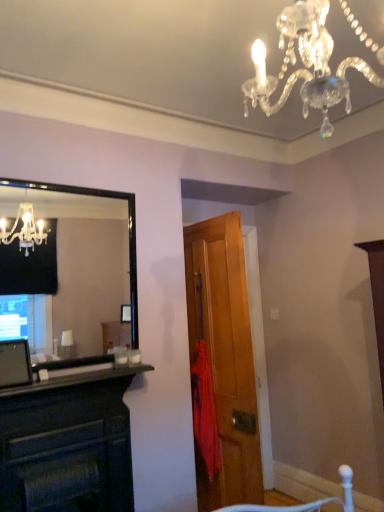
Question: Considering the relative sizes of wooden door at center and black matte fireplace at lower left in the image provided, is wooden door at center bigger than black matte fireplace at lower left?

Choices:
 (A) yes
 (B) no

Answer: (A)

Question: From the image's perspective, is wooden door at center on top of black matte fireplace at lower left?

Choices:
 (A) no
 (B) yes

Answer: (A)

Question: Is black matte fireplace at lower left completely or partially inside wooden door at center?

Choices:
 (A) no
 (B) yes

Answer: (A)

Question: Is wooden door at center further to the viewer compared to black matte fireplace at lower left?

Choices:
 (A) no
 (B) yes

Answer: (B)

Question: Is wooden door at center in front of black matte fireplace at lower left?

Choices:
 (A) yes
 (B) no

Answer: (B)

Question: Would you say black matte fireplace at lower left is to the left or to the right of red fabric umbrella at center in the picture?

Choices:
 (A) right
 (B) left

Answer: (B)

Question: From the image's perspective, relative to red fabric umbrella at center, is black matte fireplace at lower left above or below?

Choices:
 (A) above
 (B) below

Answer: (A)

Question: Is black matte fireplace at lower left situated inside red fabric umbrella at center or outside?

Choices:
 (A) outside
 (B) inside

Answer: (A)

Question: Is black matte fireplace at lower left wider or thinner than red fabric umbrella at center?

Choices:
 (A) wide
 (B) thin

Answer: (A)

Question: Relative to wooden door at center, is red fabric umbrella at center in front or behind?

Choices:
 (A) behind
 (B) front

Answer: (A)

Question: From the image's perspective, is red fabric umbrella at center located above or below wooden door at center?

Choices:
 (A) above
 (B) below

Answer: (B)

Question: Visually, is red fabric umbrella at center positioned to the left or to the right of wooden door at center?

Choices:
 (A) left
 (B) right

Answer: (A)

Question: Does point pyautogui.click(x=198, y=423) appear closer or farther from the camera than point pyautogui.click(x=254, y=416)?

Choices:
 (A) closer
 (B) farther

Answer: (A)

Question: From their relative heights in the image, would you say black glass mirror at left is taller or shorter than black matte fireplace at lower left?

Choices:
 (A) short
 (B) tall

Answer: (B)

Question: Is black glass mirror at left inside the boundaries of black matte fireplace at lower left, or outside?

Choices:
 (A) outside
 (B) inside

Answer: (A)